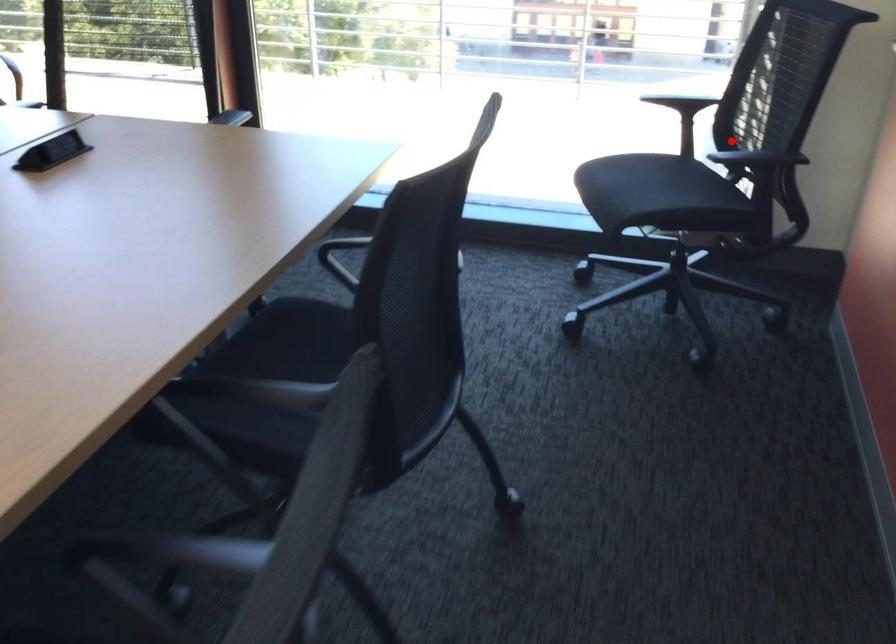
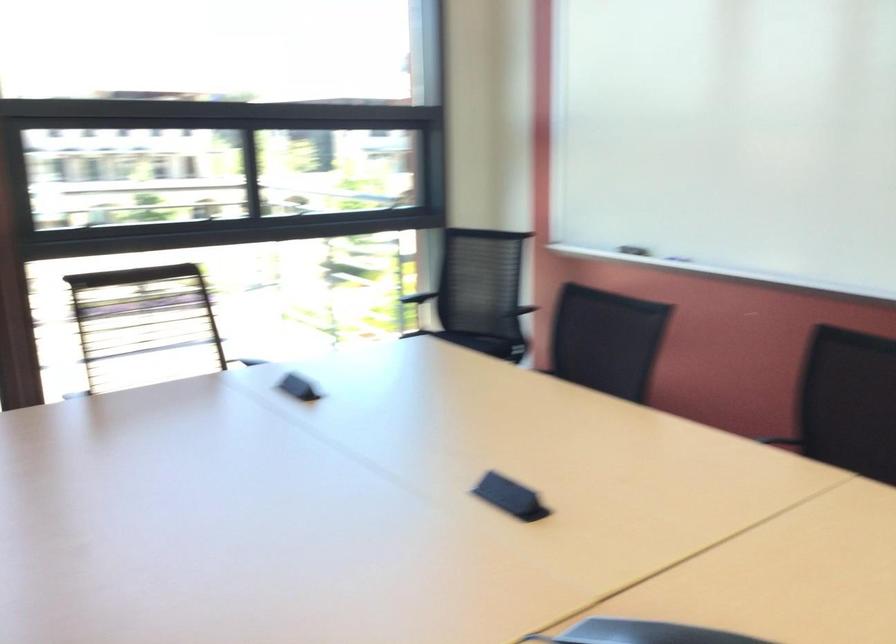
Question: I am providing you with two images of the same scene from different viewpoints. A red point is shown in image1. For the corresponding object point in image2, is it positioned nearer or farther from the camera?

Choices:
 (A) Nearer
 (B) Farther

Answer: (B)